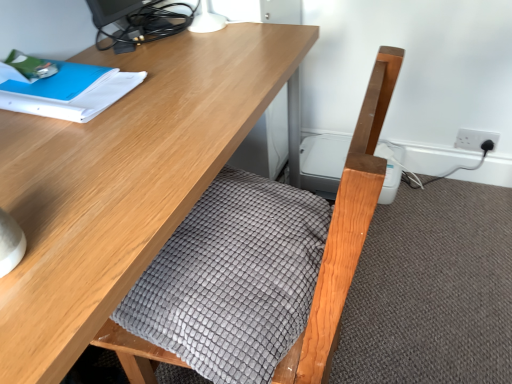
Measure the distance between point [315,259] and camera.

31.65 inches.

You are a GUI agent. You are given a task and a screenshot of the screen. Output one action in this format:
    pyautogui.click(x=<x>, y=<y>)
    Task: Click on the gray textured blanket at center
    The image size is (512, 384).
    Given the screenshot: What is the action you would take?
    pyautogui.click(x=233, y=279)

From the picture: Can you confirm if gray textured blanket at center is positioned to the right of white plastic socket at upper right?

Incorrect, gray textured blanket at center is not on the right side of white plastic socket at upper right.

Is gray textured blanket at center facing towards white plastic socket at upper right?

No, gray textured blanket at center does not turn towards white plastic socket at upper right.

Is point (200, 290) more distant than point (479, 144)?

No, (200, 290) is in front of (479, 144).

What's the angular difference between wooden desk at center and blue paper at upper left's facing directions?

The angle between the facing direction of wooden desk at center and the facing direction of blue paper at upper left is 0.36 degrees.

Does point (174, 225) lie behind point (88, 72)?

No.

Is wooden desk at center outside of blue paper at upper left?

Absolutely, wooden desk at center is external to blue paper at upper left.

Looking at their sizes, would you say wooden desk at center is wider or thinner than blue paper at upper left?

Considering their sizes, wooden desk at center looks broader than blue paper at upper left.

Is point (79, 79) closer to camera compared to point (106, 1)?

Yes, point (79, 79) is closer to viewer.

Is the surface of blue paper at upper left in direct contact with matte black monitor at upper left?

No, blue paper at upper left is not with matte black monitor at upper left.

Where is `desktop that is behind the blue paper at upper left`? Image resolution: width=512 pixels, height=384 pixels. desktop that is behind the blue paper at upper left is located at coordinates (137, 22).

Is blue paper at upper left aimed at matte black monitor at upper left?

No, blue paper at upper left is not oriented towards matte black monitor at upper left.

Does gray textured blanket at center appear on the left side of wooden desk at center?

Incorrect, gray textured blanket at center is not on the left side of wooden desk at center.

Is gray textured blanket at center turned away from wooden desk at center?

No, wooden desk at center is not at the back of gray textured blanket at center.

Can you confirm if wooden desk at center is smaller than gray textured blanket at center?

Incorrect, wooden desk at center is not smaller in size than gray textured blanket at center.

How many degrees apart are the facing directions of wooden desk at center and gray textured blanket at center?

179 degrees.

Would you say gray textured blanket at center is part of wooden desk at center's contents?

Yes, gray textured blanket at center is a part of wooden desk at center.

Which of these two, wooden desk at center or gray textured blanket at center, stands shorter?

gray textured blanket at center.

Which object is closer to the camera taking this photo, white plastic socket at upper right or matte black monitor at upper left?

matte black monitor at upper left is more forward.

From a real-world perspective, which object rests below the other?

In real-world perspective, white plastic socket at upper right is lower.

Does white plastic socket at upper right turn towards matte black monitor at upper left?

No.

Is white plastic socket at upper right beside wooden desk at center?

white plastic socket at upper right is not next to wooden desk at center, and they're not touching.

From the image's perspective, would you say white plastic socket at upper right is shown under wooden desk at center?

Actually, white plastic socket at upper right appears above wooden desk at center in the image.

Can you confirm if white plastic socket at upper right is positioned to the right of wooden desk at center?

Indeed, white plastic socket at upper right is positioned on the right side of wooden desk at center.

Where is `electric outlet on the right side of gray textured blanket at center`? The height and width of the screenshot is (384, 512). electric outlet on the right side of gray textured blanket at center is located at coordinates (474, 139).

You are a GUI agent. You are given a task and a screenshot of the screen. Output one action in this format:
    pyautogui.click(x=<x>, y=<y>)
    Task: Click on the notebook above the wooden desk at center (from a real-world perspective)
    
    Given the screenshot: What is the action you would take?
    pyautogui.click(x=69, y=92)

Looking at the image, which one is located closer to gray textured blanket at center, matte black monitor at upper left or white plastic socket at upper right?

matte black monitor at upper left.

From the picture: Which object lies further to the anchor point gray textured blanket at center, wooden desk at center or blue paper at upper left?

Based on the image, blue paper at upper left appears to be further to gray textured blanket at center.

Estimate the real-world distances between objects in this image. Which object is closer to matte black monitor at upper left, wooden desk at center or white plastic socket at upper right?

Based on the image, wooden desk at center appears to be nearer to matte black monitor at upper left.

In the scene shown: Looking at the image, which one is located closer to blue paper at upper left, matte black monitor at upper left or white plastic socket at upper right?

matte black monitor at upper left lies closer to blue paper at upper left than the other object.

From the image, which object appears to be farther from gray textured blanket at center, wooden desk at center or matte black monitor at upper left?

matte black monitor at upper left.

Based on their spatial positions, is gray textured blanket at center or blue paper at upper left further from white plastic socket at upper right?

The object further to white plastic socket at upper right is blue paper at upper left.

Which object lies nearer to the anchor point gray textured blanket at center, blue paper at upper left or white plastic socket at upper right?

The object closer to gray textured blanket at center is blue paper at upper left.

From the picture: Looking at the image, which one is located closer to matte black monitor at upper left, white plastic socket at upper right or blue paper at upper left?

blue paper at upper left.

The height and width of the screenshot is (384, 512). Identify the location of desk between blue paper at upper left and gray textured blanket at center from left to right. (123, 181).

Find the location of a particular element. The image size is (512, 384). notebook between matte black monitor at upper left and wooden desk at center vertically is located at coordinates (69, 92).

Where is `desk located between matte black monitor at upper left and white plastic socket at upper right in the left-right direction`? desk located between matte black monitor at upper left and white plastic socket at upper right in the left-right direction is located at coordinates click(x=123, y=181).

This screenshot has height=384, width=512. In order to click on desk between matte black monitor at upper left and gray textured blanket at center in the up-down direction in this screenshot , I will do `click(123, 181)`.